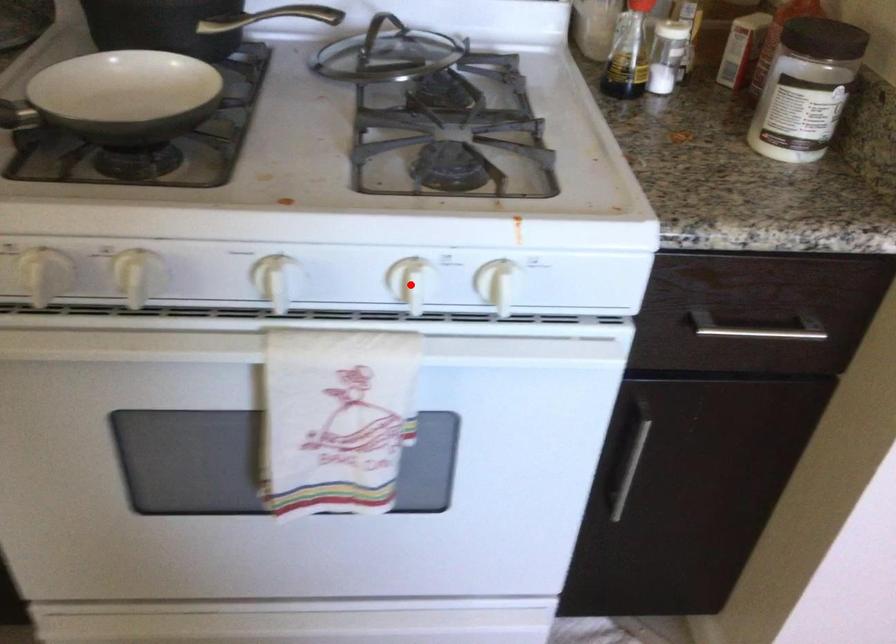
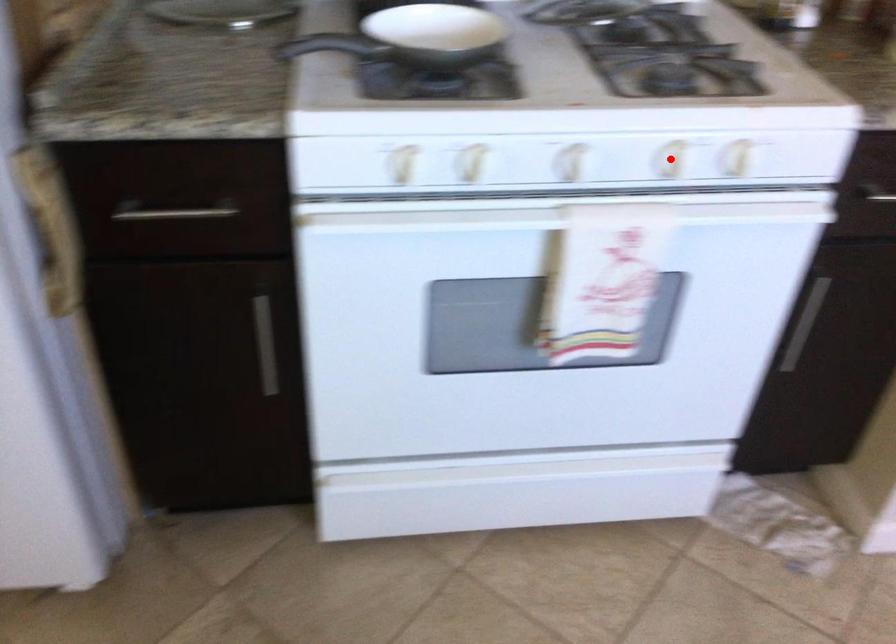
I am providing you with two images of the same scene from different viewpoints. A red point is marked on the first image and another point is marked on the second image. Does the point marked in image1 correspond to the same location as the one in image2?

Yes